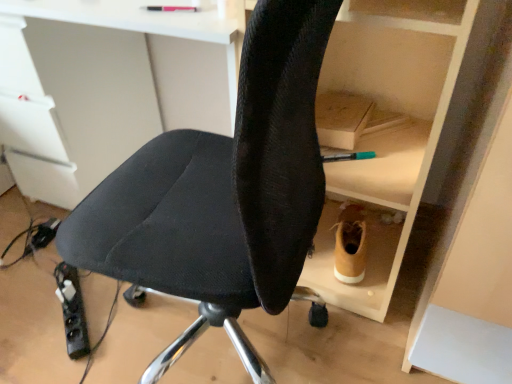
Question: Can you confirm if black fabric chair at center is taller than tan suede boot at lower right?

Choices:
 (A) no
 (B) yes

Answer: (B)

Question: From the image's perspective, is black fabric chair at center beneath tan suede boot at lower right?

Choices:
 (A) no
 (B) yes

Answer: (A)

Question: Is black fabric chair at center not close to tan suede boot at lower right?

Choices:
 (A) no
 (B) yes

Answer: (A)

Question: Is black fabric chair at center closer to camera compared to tan suede boot at lower right?

Choices:
 (A) yes
 (B) no

Answer: (A)

Question: Is black fabric chair at center shorter than tan suede boot at lower right?

Choices:
 (A) yes
 (B) no

Answer: (B)

Question: Is tan suede boot at lower right inside black fabric chair at center?

Choices:
 (A) no
 (B) yes

Answer: (A)

Question: Is black plastic power strip at lower left bigger than tan suede boot at lower right?

Choices:
 (A) no
 (B) yes

Answer: (A)

Question: Is black plastic power strip at lower left directly adjacent to tan suede boot at lower right?

Choices:
 (A) no
 (B) yes

Answer: (A)

Question: Is tan suede boot at lower right at the back of black plastic power strip at lower left?

Choices:
 (A) yes
 (B) no

Answer: (B)

Question: From the image's perspective, is black plastic power strip at lower left on top of tan suede boot at lower right?

Choices:
 (A) yes
 (B) no

Answer: (B)

Question: From the image's perspective, is black plastic power strip at lower left under tan suede boot at lower right?

Choices:
 (A) no
 (B) yes

Answer: (B)

Question: Is black plastic power strip at lower left located outside tan suede boot at lower right?

Choices:
 (A) no
 (B) yes

Answer: (B)

Question: Can you confirm if black fabric chair at center is positioned to the left of black plastic power strip at lower left?

Choices:
 (A) no
 (B) yes

Answer: (A)